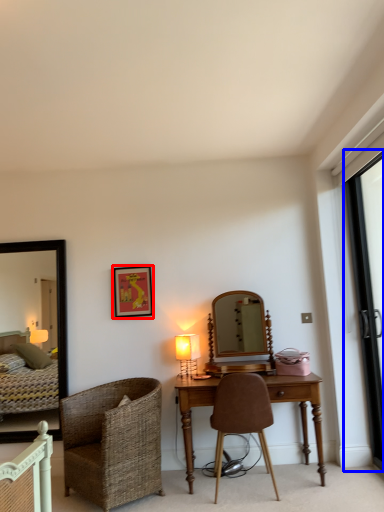
Question: Which point is closer to the camera, picture frame (highlighted by a red box) or screen door (highlighted by a blue box)?

Choices:
 (A) picture frame
 (B) screen door

Answer: (B)